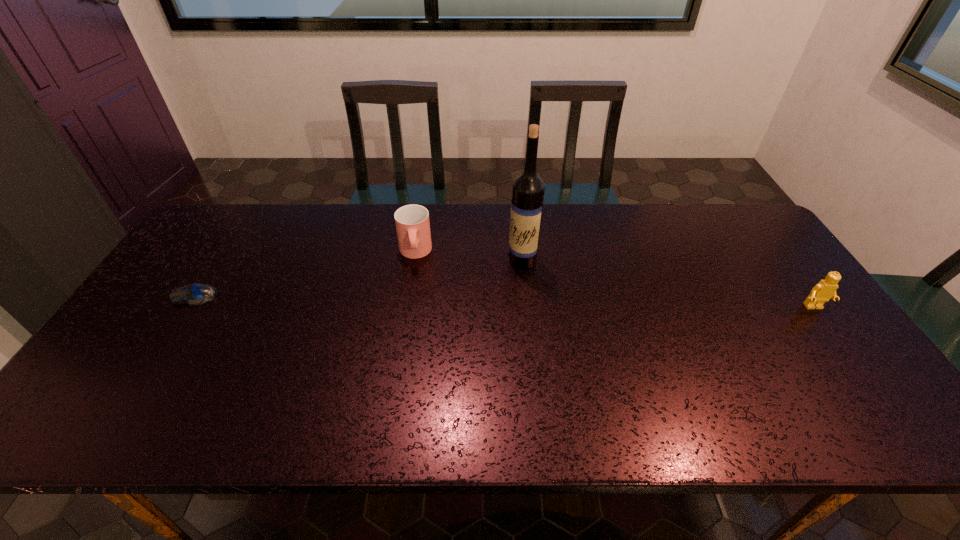
Locate which object is the third closest to the rightmost object. Please provide its 2D coordinates. Your answer should be formatted as a tuple, i.e. [(x, y)], where the tuple contains the x and y coordinates of a point satisfying the conditions above.

[(196, 294)]

This screenshot has width=960, height=540. What are the coordinates of `the second closest object to the rightmost object` in the screenshot? It's located at (412, 222).